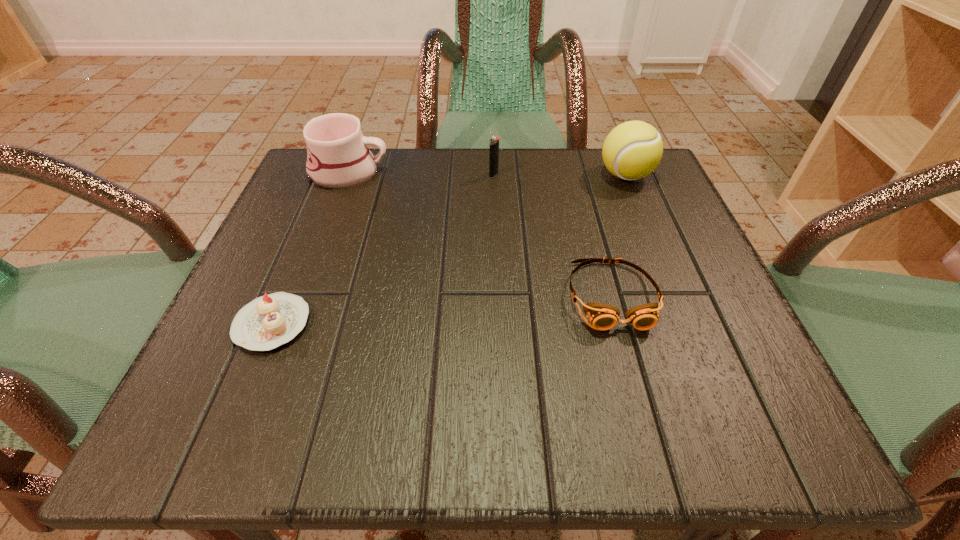
Identify the location of vacant space located on the right of the cupcake. The image size is (960, 540). (581, 323).

This screenshot has height=540, width=960. In order to click on tennis ball that is at the far edge in this screenshot , I will do `click(632, 150)`.

Find the location of a particular element. The width and height of the screenshot is (960, 540). mug situated at the far edge is located at coordinates (338, 156).

At what (x,y) coordinates should I click in order to perform the action: click on igniter located at the far edge. Please return your answer as a coordinate pair (x, y). Looking at the image, I should click on (494, 141).

You are a GUI agent. You are given a task and a screenshot of the screen. Output one action in this format:
    pyautogui.click(x=<x>, y=<y>)
    Task: Click on the mug at the left edge
    The image size is (960, 540).
    Given the screenshot: What is the action you would take?
    [338, 156]

In order to click on cupcake that is positioned at the left edge in this screenshot , I will do `click(267, 322)`.

Image resolution: width=960 pixels, height=540 pixels. What are the coordinates of `tennis ball at the right edge` in the screenshot? It's located at (632, 150).

Identify the location of goggles at the right edge. (602, 316).

Locate an element on the screen. The height and width of the screenshot is (540, 960). object that is at the far left corner is located at coordinates (338, 156).

Find the location of `object that is positioned at the far right corner`. object that is positioned at the far right corner is located at coordinates (632, 150).